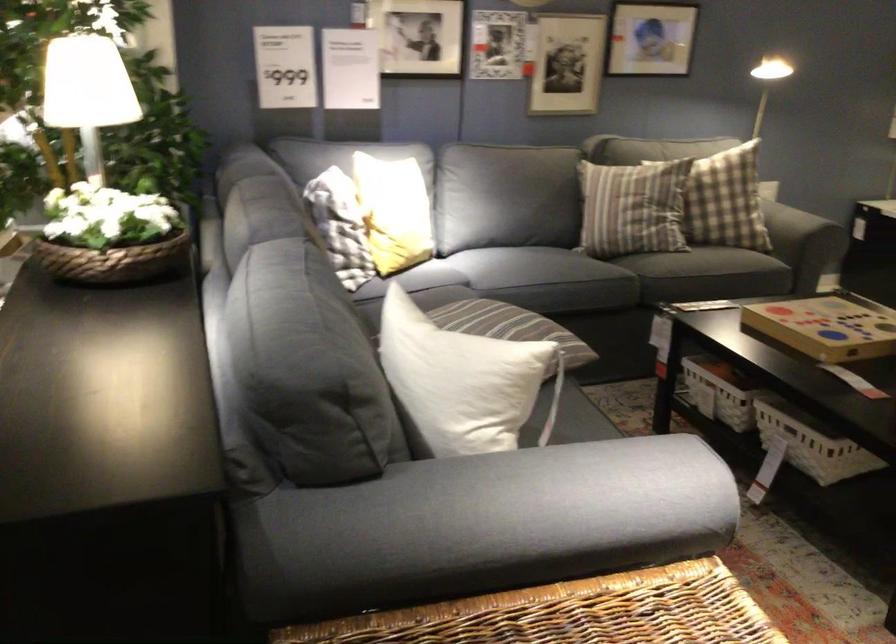
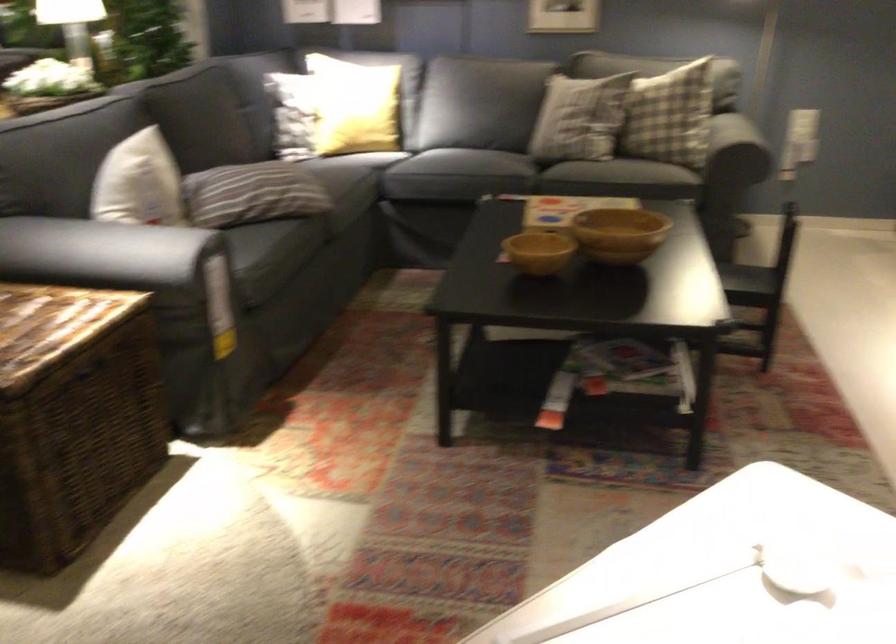
Question: The images are taken continuously from a first-person perspective. In which direction are you moving?

Choices:
 (A) Left
 (B) Right
 (C) Forward
 (D) Backward

Answer: (B)